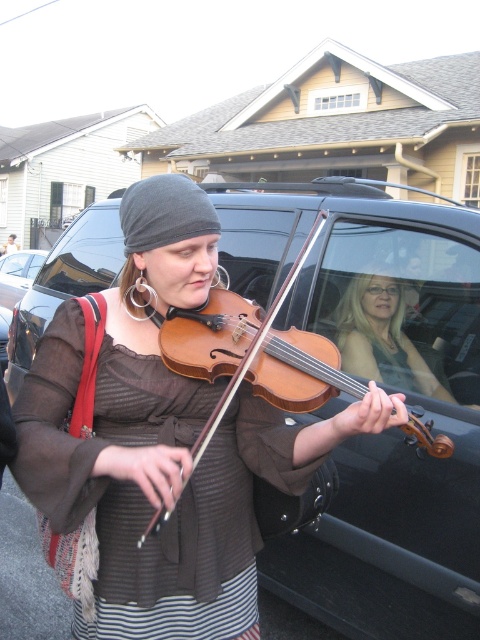
Question: Is matte brown hair at center positioned behind shiny silver car at center?

Choices:
 (A) yes
 (B) no

Answer: (B)

Question: Is shiny black car at center to the left of wooden violin at center from the viewer's perspective?

Choices:
 (A) no
 (B) yes

Answer: (A)

Question: Which object appears closest to the camera in this image?

Choices:
 (A) matte brown hair at center
 (B) wooden violin at center
 (C) shiny silver car at center
 (D) shiny black car at center

Answer: (B)

Question: Which of the following is the closest to the observer?

Choices:
 (A) (374, 321)
 (B) (24, 262)
 (C) (156, 525)

Answer: (C)

Question: Can you confirm if shiny black car at center is thinner than wooden violin at center?

Choices:
 (A) no
 (B) yes

Answer: (A)

Question: Estimate the real-world distances between objects in this image. Which object is farther from the shiny silver car at center?

Choices:
 (A) shiny black car at center
 (B) matte brown hair at center

Answer: (B)